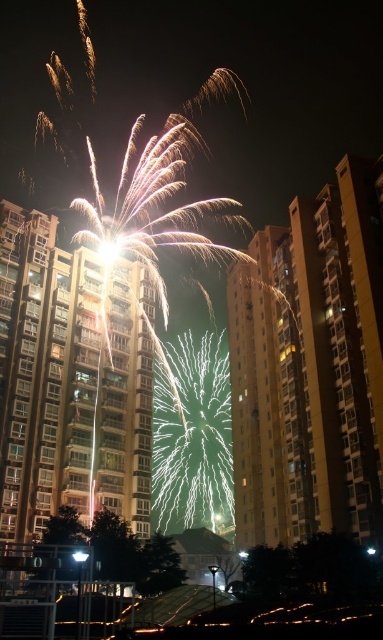
You are standing at the origin point in the image and want to look at the fireworks. Which point, point (106,253) or point (75,557), is closer to you?

Point (75,557) is closer to you because it is in front of point (106,253).

You are a photographer trying to capture the fireworks display. You notice the bright white sparkler at center and the white glass streetlight at center in your shot. Which object appears taller in the image?

The bright white sparkler at center appears taller than the white glass streetlight at center in the image.